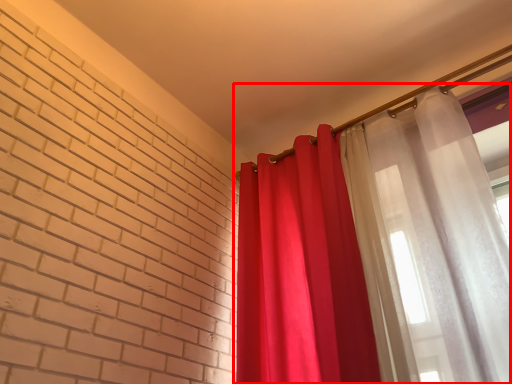
Question: Where is curtain (annotated by the red box) located in relation to curtain in the image?

Choices:
 (A) left
 (B) right

Answer: (B)